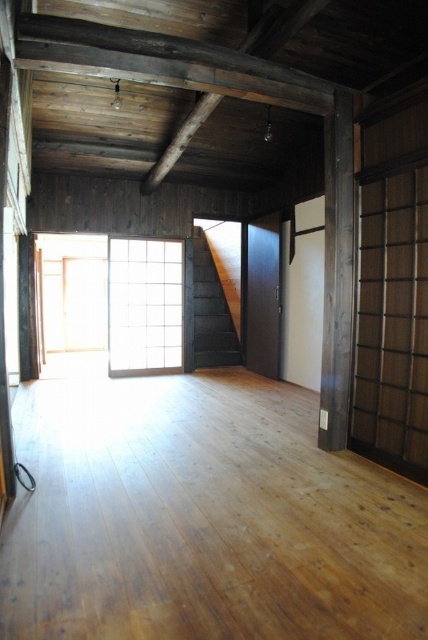
Question: Observing the image, what is the correct spatial positioning of white grid screen at center in reference to brown wooden beam at center?

Choices:
 (A) left
 (B) right

Answer: (A)

Question: Which point appears farthest from the camera in this image?

Choices:
 (A) [x=130, y=358]
 (B) [x=199, y=108]

Answer: (A)

Question: Does white grid screen at center have a smaller size compared to brown wooden beam at center?

Choices:
 (A) no
 (B) yes

Answer: (A)

Question: Does white grid screen at center have a greater width compared to brown wooden beam at center?

Choices:
 (A) no
 (B) yes

Answer: (A)